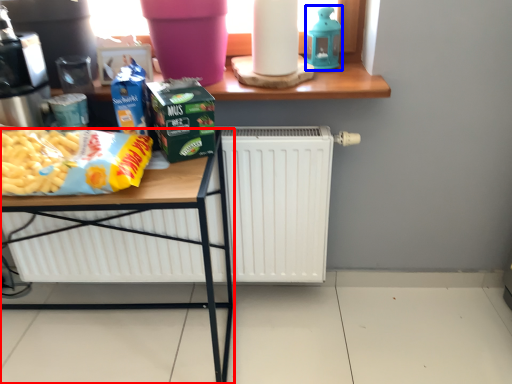
Question: Which object is further to the camera taking this photo, table (highlighted by a red box) or appliance (highlighted by a blue box)?

Choices:
 (A) table
 (B) appliance

Answer: (B)